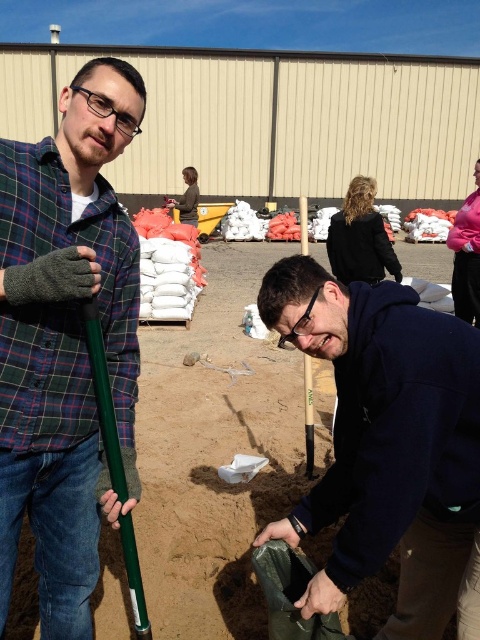
Does point (23, 292) lie in front of point (357, 314)?

Yes, it is in front of point (357, 314).

How much distance is there between green plastic shovel at left and dark blue hoodie at center?

26.35 inches

Image resolution: width=480 pixels, height=640 pixels. Describe the element at coordinates (66, 339) in the screenshot. I see `green plastic shovel at left` at that location.

Locate an element on the screen. The image size is (480, 640). green plastic shovel at left is located at coordinates 66,339.

Who is positioned more to the left, green plastic shovel at left or brown sandy dirt at center?

Positioned to the left is green plastic shovel at left.

Image resolution: width=480 pixels, height=640 pixels. Find the location of `green plastic shovel at left`. green plastic shovel at left is located at coordinates (66, 339).

Image resolution: width=480 pixels, height=640 pixels. Identify the location of green plastic shovel at left. (66, 339).

In the scene shown: Can you confirm if brown sandy dirt at center is positioned above dark blue hoodie at center?

Correct, brown sandy dirt at center is located above dark blue hoodie at center.

You are a GUI agent. You are given a task and a screenshot of the screen. Output one action in this format:
    pyautogui.click(x=<x>, y=<y>)
    Task: Click on the brown sandy dirt at center
    
    Given the screenshot: What is the action you would take?
    pyautogui.click(x=214, y=454)